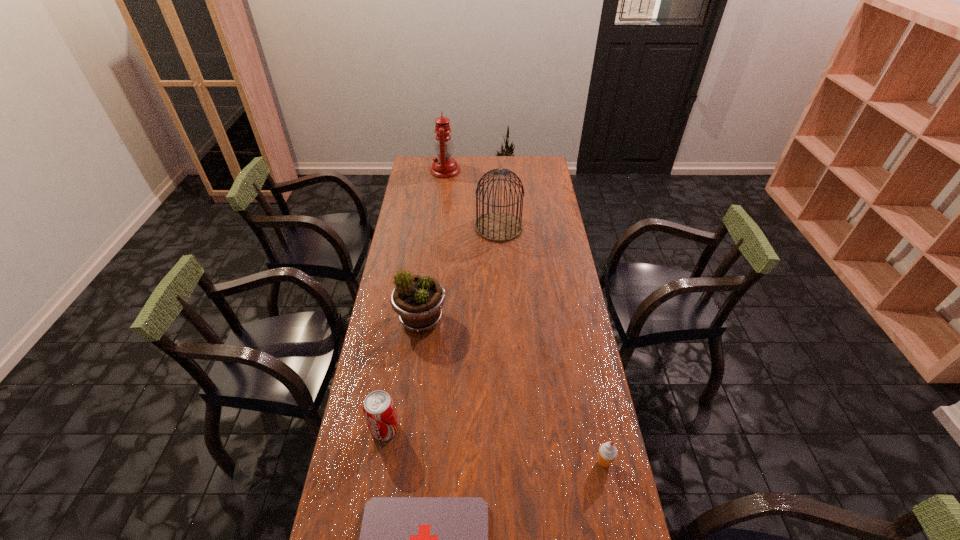
Where is `the farthest object`? Image resolution: width=960 pixels, height=540 pixels. the farthest object is located at coordinates (444, 166).

At what (x,y) coordinates should I click in order to perform the action: click on birdcage. Please return your answer as a coordinate pair (x, y). The image size is (960, 540). Looking at the image, I should click on (497, 226).

The height and width of the screenshot is (540, 960). What are the coordinates of `flowerpot` in the screenshot? It's located at click(x=418, y=300).

I want to click on the fourth nearest object, so click(418, 300).

Image resolution: width=960 pixels, height=540 pixels. What are the coordinates of `the fourth tallest object` in the screenshot? It's located at (379, 410).

At what (x,y) coordinates should I click in order to perform the action: click on soda can. Please return your answer as a coordinate pair (x, y). Looking at the image, I should click on (x=379, y=410).

Find the location of a particular element. icecream is located at coordinates (x=607, y=453).

What are the coordinates of `the rightmost object` in the screenshot? It's located at (607, 453).

Find the location of a particular element. This screenshot has height=540, width=960. vacant point located 0.130m on the right of the farthest object is located at coordinates (485, 170).

Identify the location of free spot located 0.140m at the door of the birdcage. (500, 264).